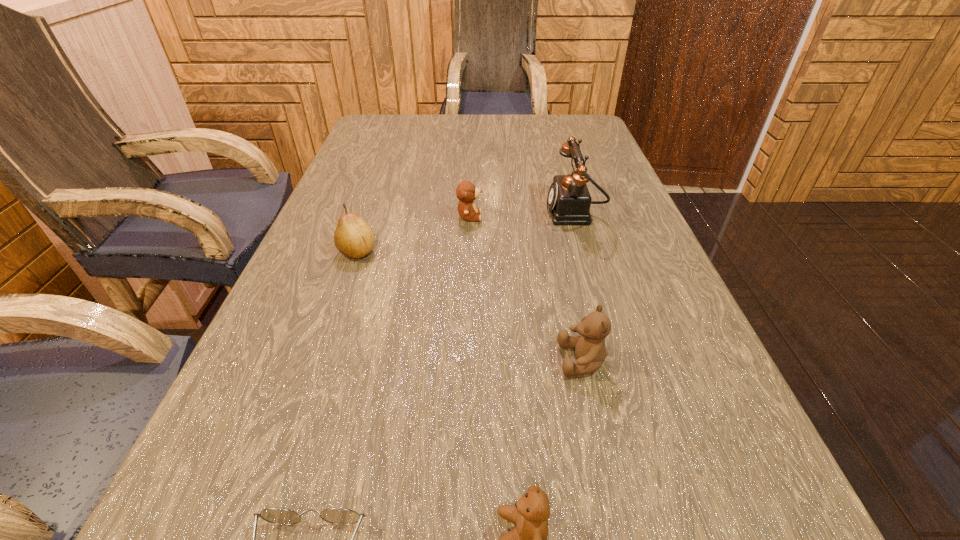
Locate an element on the screen. This screenshot has width=960, height=540. blank area located on the front-facing side of the fourth farthest object is located at coordinates (417, 360).

The height and width of the screenshot is (540, 960). What are the coordinates of `vacant region located 0.210m on the front-facing side of the fourth farthest object` in the screenshot? It's located at (429, 360).

Where is `free point located on the front-facing side of the fourth farthest object`? Image resolution: width=960 pixels, height=540 pixels. free point located on the front-facing side of the fourth farthest object is located at coordinates (485, 360).

The width and height of the screenshot is (960, 540). I want to click on vacant area located 0.210m on the face of the third object from left to right, so click(x=572, y=217).

Locate an element on the screen. Image resolution: width=960 pixels, height=540 pixels. object at the left edge is located at coordinates (353, 237).

Find the location of a particular element. object that is at the right edge is located at coordinates (569, 201).

The image size is (960, 540). In the image, there is a desktop. What are the coordinates of `vacant space at the left edge` in the screenshot? It's located at (342, 187).

You are a GUI agent. You are given a task and a screenshot of the screen. Output one action in this format:
    pyautogui.click(x=<x>, y=<y>)
    Task: Click on the free space at the right edge of the desktop
    This screenshot has width=960, height=540.
    Given the screenshot: What is the action you would take?
    pyautogui.click(x=613, y=222)

The width and height of the screenshot is (960, 540). In the image, there is a desktop. Identify the location of free space at the far left corner. (410, 140).

Where is `vacant area at the far right corner of the desktop`? vacant area at the far right corner of the desktop is located at coordinates (550, 115).